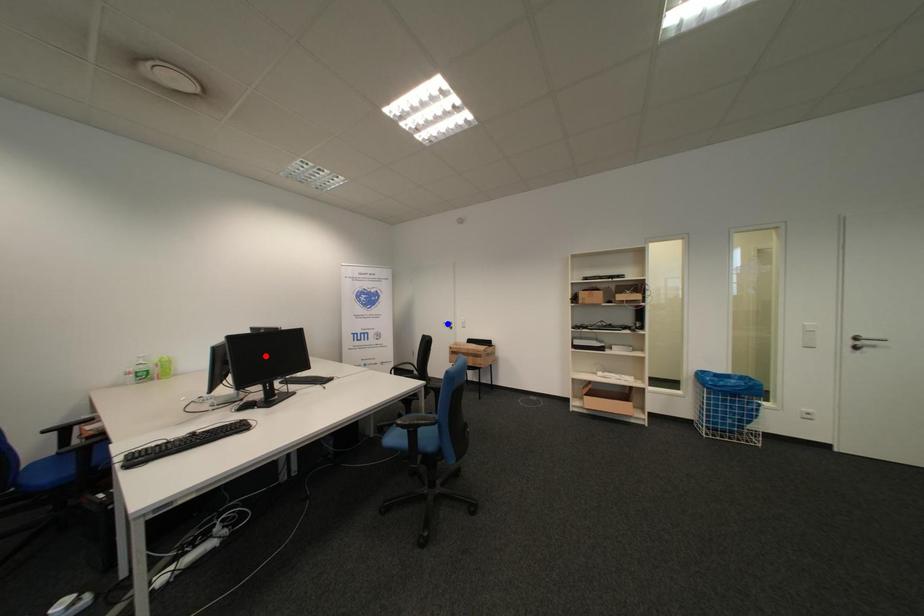
Question: In the image, two points are highlighted. Which point is nearer to the camera? Reply with the corresponding letter.

Choices:
 (A) blue point
 (B) red point

Answer: (B)